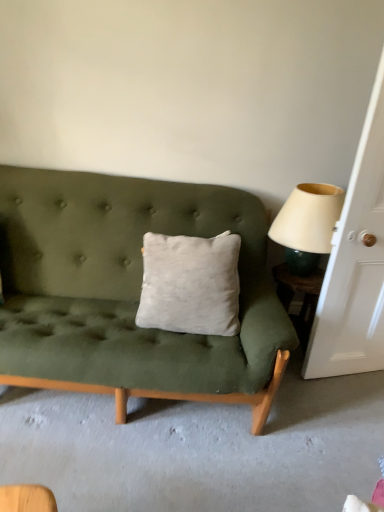
Question: Is white wood door at right taller than green glossy side table at right?

Choices:
 (A) no
 (B) yes

Answer: (B)

Question: From a real-world perspective, does white wood door at right stand above green glossy side table at right?

Choices:
 (A) no
 (B) yes

Answer: (B)

Question: From a real-world perspective, is white wood door at right beneath green glossy side table at right?

Choices:
 (A) no
 (B) yes

Answer: (A)

Question: Can you confirm if white wood door at right is bigger than green glossy side table at right?

Choices:
 (A) yes
 (B) no

Answer: (A)

Question: Does white wood door at right have a greater width compared to green glossy side table at right?

Choices:
 (A) no
 (B) yes

Answer: (A)

Question: Is green glossy side table at right to the left or to the right of white wood door at right in the image?

Choices:
 (A) left
 (B) right

Answer: (A)

Question: Is green glossy side table at right taller or shorter than white wood door at right?

Choices:
 (A) short
 (B) tall

Answer: (A)

Question: Is green glossy side table at right inside or outside of white wood door at right?

Choices:
 (A) inside
 (B) outside

Answer: (B)

Question: In the image, is green glossy side table at right positioned in front of or behind white wood door at right?

Choices:
 (A) front
 (B) behind

Answer: (B)

Question: In terms of size, does white wood door at right appear bigger or smaller than green glossy side table at right?

Choices:
 (A) big
 (B) small

Answer: (A)

Question: Considering the positions of white wood door at right and green glossy side table at right in the image, is white wood door at right wider or thinner than green glossy side table at right?

Choices:
 (A) wide
 (B) thin

Answer: (B)

Question: In the image, is white wood door at right positioned in front of or behind green glossy side table at right?

Choices:
 (A) behind
 (B) front

Answer: (B)

Question: Is white wood door at right inside or outside of green glossy side table at right?

Choices:
 (A) inside
 (B) outside

Answer: (B)

Question: From a real-world perspective, is green glossy side table at right above or below beige fabric lampshade at right?

Choices:
 (A) above
 (B) below

Answer: (B)

Question: Considering the positions of point (309, 284) and point (317, 221), is point (309, 284) closer or farther from the camera than point (317, 221)?

Choices:
 (A) farther
 (B) closer

Answer: (A)